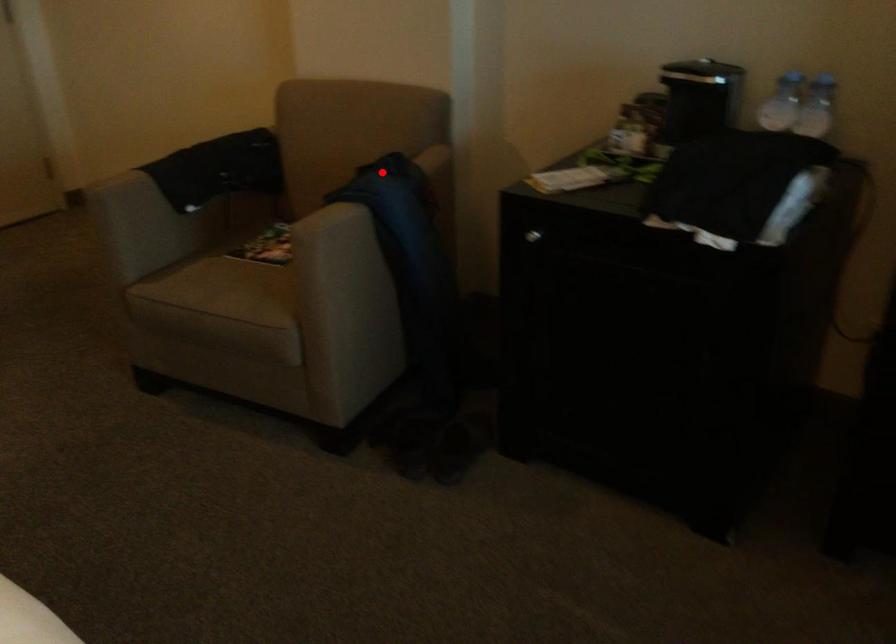
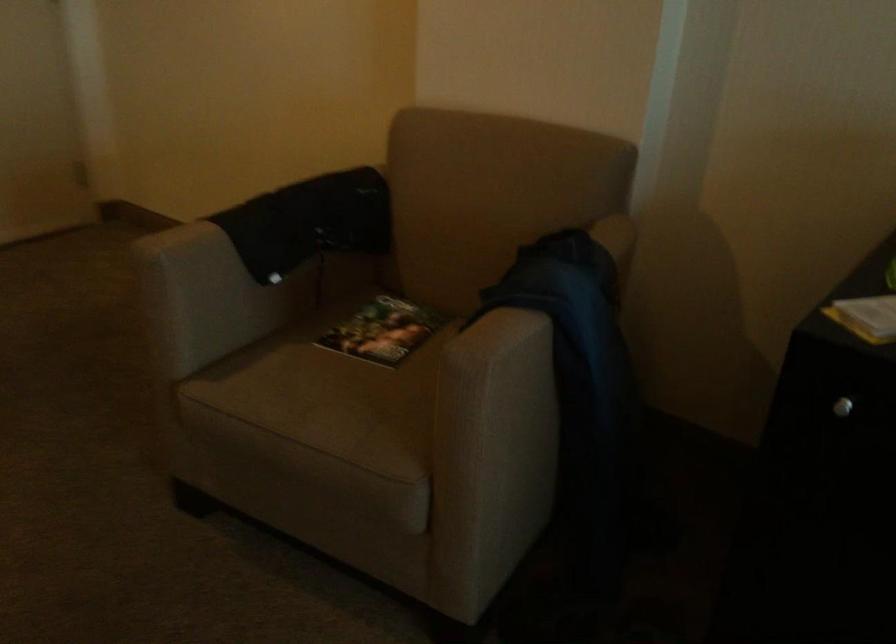
Question: I am providing you with two images of the same scene from different viewpoints. Image1 has a red point marked. In image2, the corresponding 3D location appears at what relative position? Reply with the corresponding letter.

Choices:
 (A) Closer
 (B) Farther

Answer: (A)